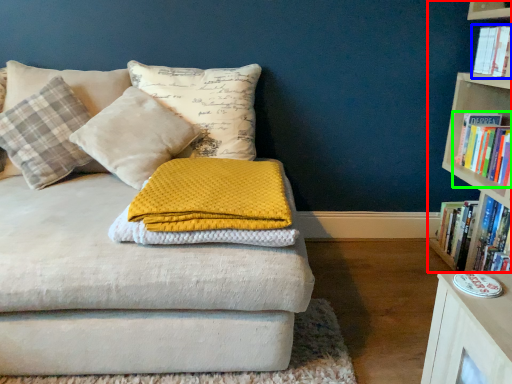
Question: Which is nearer to the bookcase (highlighted by a red box)? book (highlighted by a blue box) or book (highlighted by a green box).

Choices:
 (A) book
 (B) book

Answer: (B)